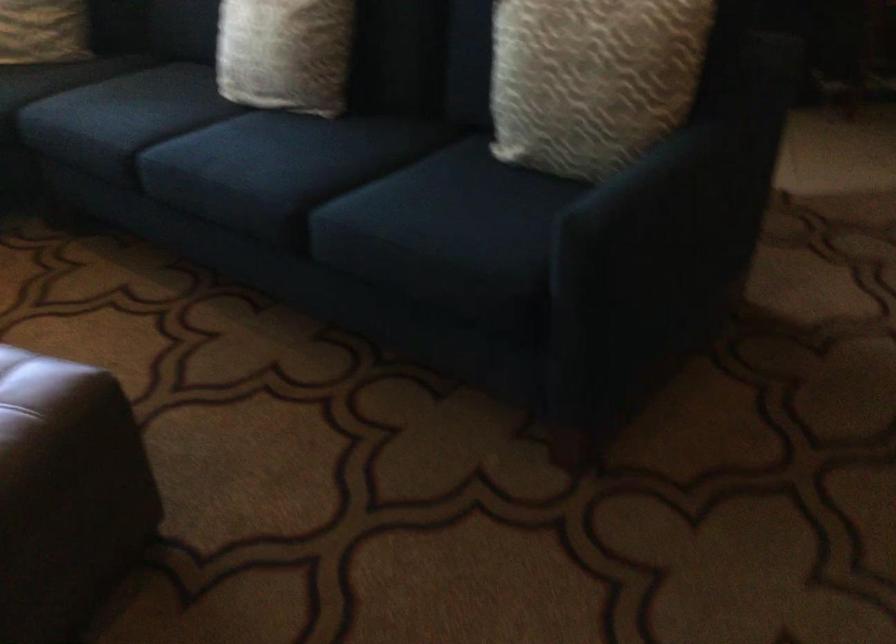
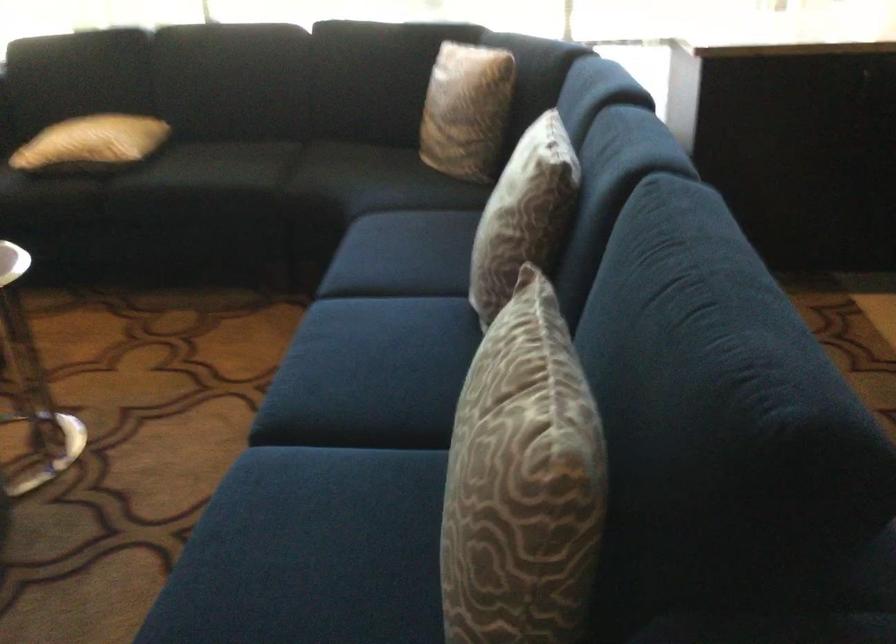
The point at (x=376, y=187) is marked in the first image. Where is the corresponding point in the second image?

(341, 458)